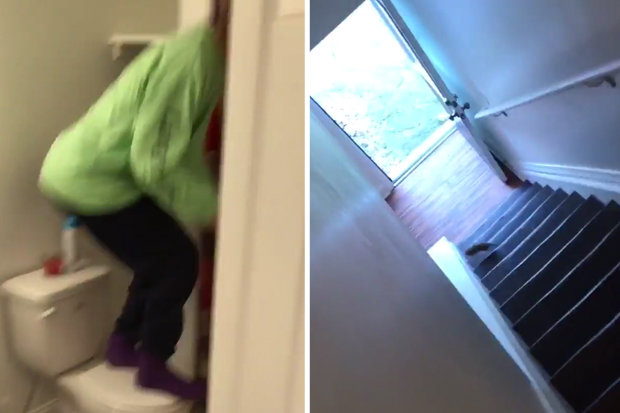
Locate an element on the screen. The height and width of the screenshot is (413, 620). floor is located at coordinates (459, 217).